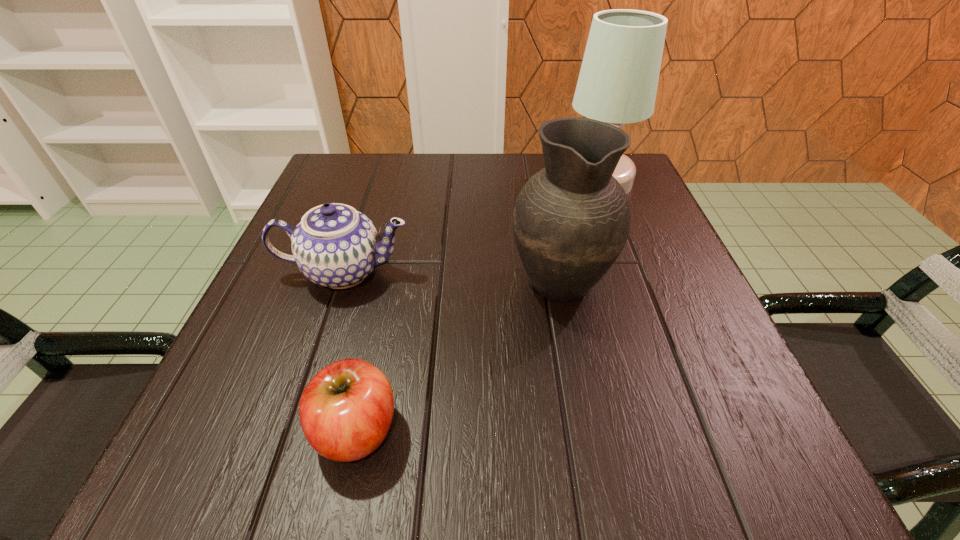
Image resolution: width=960 pixels, height=540 pixels. Find the location of `vacant area that satisfies the following two spatial constraints: 1. at the spout of the nearest object; 2. on the right side of the chinaware`. vacant area that satisfies the following two spatial constraints: 1. at the spout of the nearest object; 2. on the right side of the chinaware is located at coordinates (292, 430).

Where is `vacant space that satisfies the following two spatial constraints: 1. on the base of the farthest object; 2. at the spout of the third tallest object`? The image size is (960, 540). vacant space that satisfies the following two spatial constraints: 1. on the base of the farthest object; 2. at the spout of the third tallest object is located at coordinates (632, 272).

Identify the location of free spot that satisfies the following two spatial constraints: 1. on the base of the lampshade; 2. at the spout of the third tallest object. (632, 272).

Locate an element on the screen. vacant space that satisfies the following two spatial constraints: 1. at the spout of the shortest object; 2. on the right side of the second shortest object is located at coordinates (292, 430).

Where is `vacant space that satisfies the following two spatial constraints: 1. at the spout of the apple; 2. on the right side of the third tallest object`? vacant space that satisfies the following two spatial constraints: 1. at the spout of the apple; 2. on the right side of the third tallest object is located at coordinates (292, 430).

Where is `free space that satisfies the following two spatial constraints: 1. on the base of the farthest object; 2. at the spout of the second shortest object`? This screenshot has width=960, height=540. free space that satisfies the following two spatial constraints: 1. on the base of the farthest object; 2. at the spout of the second shortest object is located at coordinates pyautogui.click(x=632, y=272).